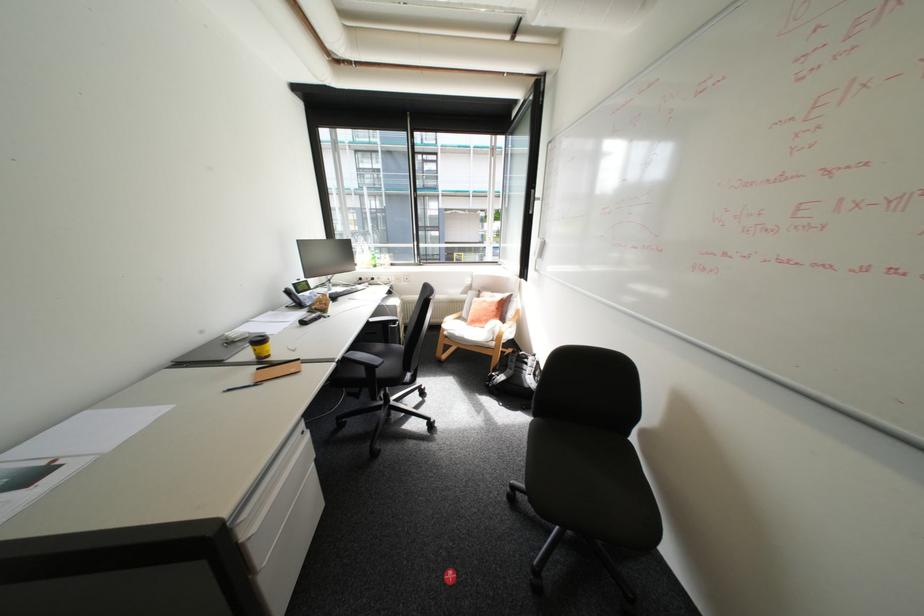
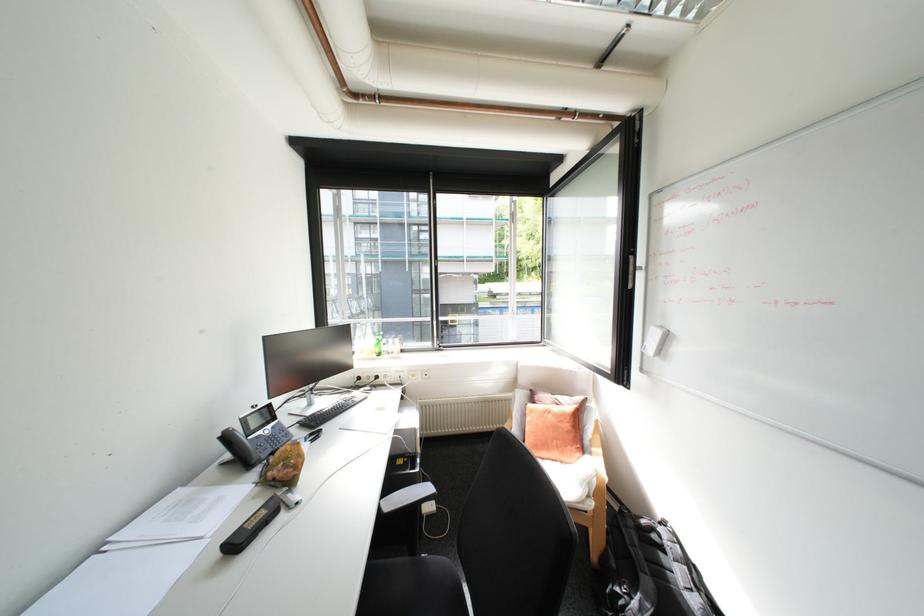
Locate, in the second image, the point that corresponds to (314,320) in the first image.

(248, 539)